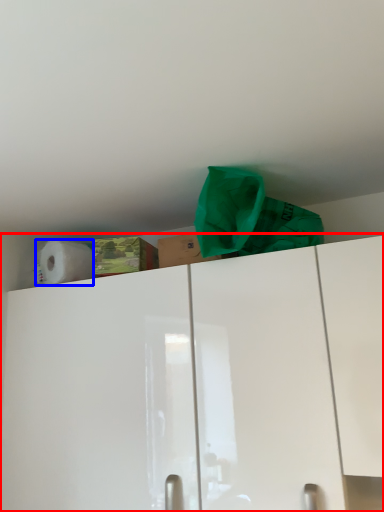
Question: Among these objects, which one is nearest to the camera, cabinetry (highlighted by a red box) or paper towel (highlighted by a blue box)?

Choices:
 (A) cabinetry
 (B) paper towel

Answer: (A)